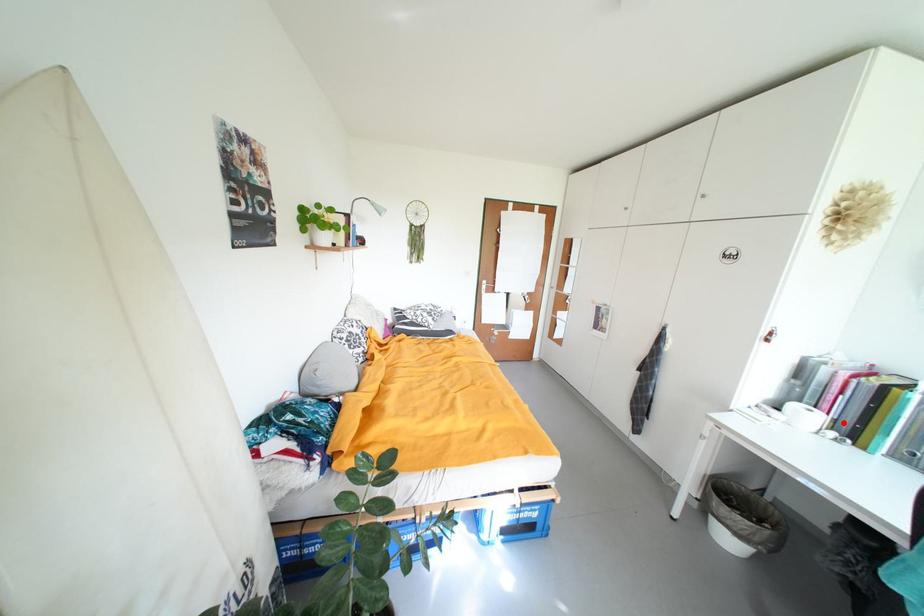
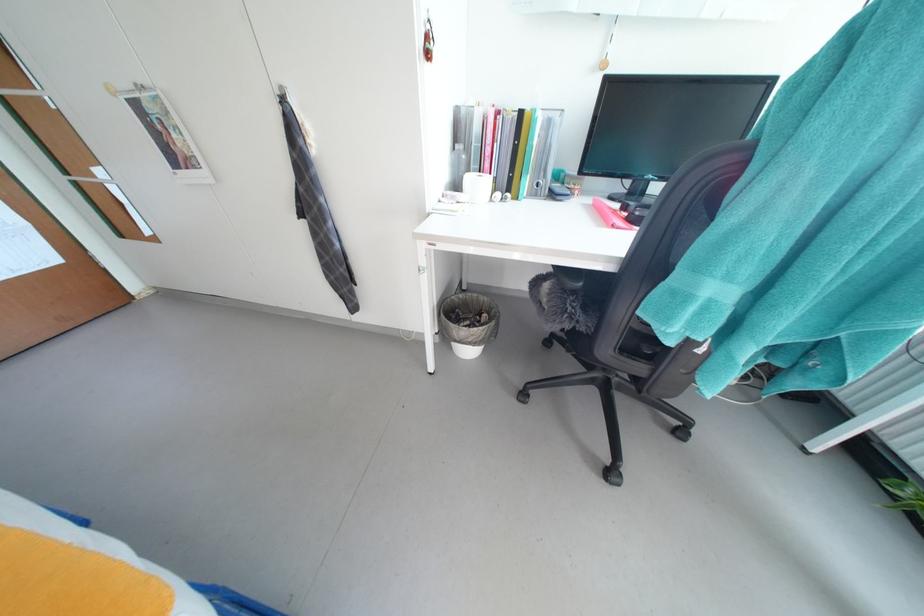
In the second image, find the point that corresponds to the highlighted location in the first image.

(503, 182)